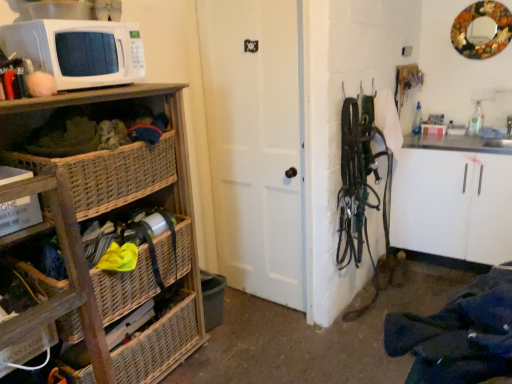
Question: Should I look upward or downward to see woven wood basket at left?

Choices:
 (A) up
 (B) down

Answer: (A)

Question: From a real-world perspective, does woven wood shelf at left sit lower than white matte door at center?

Choices:
 (A) no
 (B) yes

Answer: (B)

Question: Is woven wood shelf at left behind white matte door at center?

Choices:
 (A) yes
 (B) no

Answer: (B)

Question: Is woven wood shelf at left at the left side of white matte door at center?

Choices:
 (A) no
 (B) yes

Answer: (B)

Question: Is woven wood shelf at left not inside white matte door at center?

Choices:
 (A) no
 (B) yes

Answer: (B)

Question: Can you confirm if woven wood shelf at left is positioned to the right of white matte door at center?

Choices:
 (A) no
 (B) yes

Answer: (A)

Question: Is woven wood shelf at left positioned with its back to white matte door at center?

Choices:
 (A) yes
 (B) no

Answer: (B)

Question: From a real-world perspective, does woven wicker basket at lower left, which ranks as the first basket in top-to-bottom order, sit lower than woven wood basket at left?

Choices:
 (A) no
 (B) yes

Answer: (B)

Question: Is woven wicker basket at lower left, which ranks as the first basket in top-to-bottom order, next to woven wood basket at left?

Choices:
 (A) yes
 (B) no

Answer: (B)

Question: Considering the relative positions of woven wicker basket at lower left, which is counted as the second basket, starting from the bottom, and woven wood basket at left in the image provided, is woven wicker basket at lower left, which is counted as the second basket, starting from the bottom, in front of woven wood basket at left?

Choices:
 (A) no
 (B) yes

Answer: (A)

Question: Can you confirm if woven wicker basket at lower left, which ranks as the first basket in top-to-bottom order, is taller than woven wood basket at left?

Choices:
 (A) yes
 (B) no

Answer: (A)

Question: Considering the relative positions of woven wicker basket at lower left, which is counted as the second basket, starting from the bottom, and woven wood basket at left in the image provided, is woven wicker basket at lower left, which is counted as the second basket, starting from the bottom, behind woven wood basket at left?

Choices:
 (A) no
 (B) yes

Answer: (B)

Question: Is woven wood basket at left at the back of woven wicker basket at lower left, which ranks as the first basket in top-to-bottom order?

Choices:
 (A) yes
 (B) no

Answer: (B)

Question: Considering the relative sizes of woven wood basket at left and woven wood basket at lower left, the first basket positioned from the bottom, in the image provided, is woven wood basket at left thinner than woven wood basket at lower left, the first basket positioned from the bottom,?

Choices:
 (A) yes
 (B) no

Answer: (A)